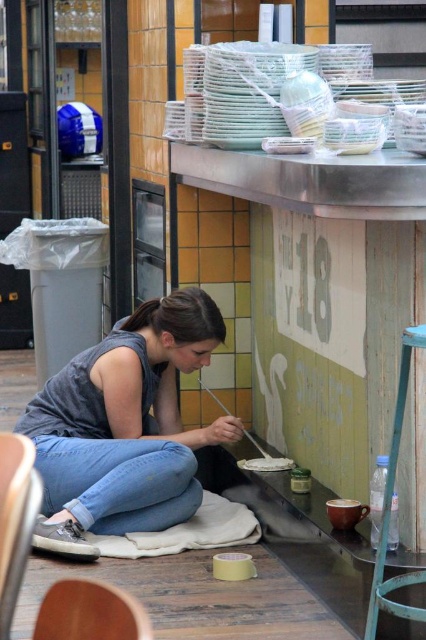
Question: Which point appears closest to the camera in this image?

Choices:
 (A) (287, 460)
 (B) (39, 404)

Answer: (B)

Question: Which object appears farthest from the camera in this image?

Choices:
 (A) white matte paint at lower center
 (B) gray cotton shirt at center

Answer: (A)

Question: Can you confirm if gray cotton shirt at center is smaller than white matte paint at lower center?

Choices:
 (A) no
 (B) yes

Answer: (A)

Question: Does gray cotton shirt at center appear on the right side of white matte paint at lower center?

Choices:
 (A) no
 (B) yes

Answer: (A)

Question: Is gray cotton shirt at center smaller than white matte paint at lower center?

Choices:
 (A) no
 (B) yes

Answer: (A)